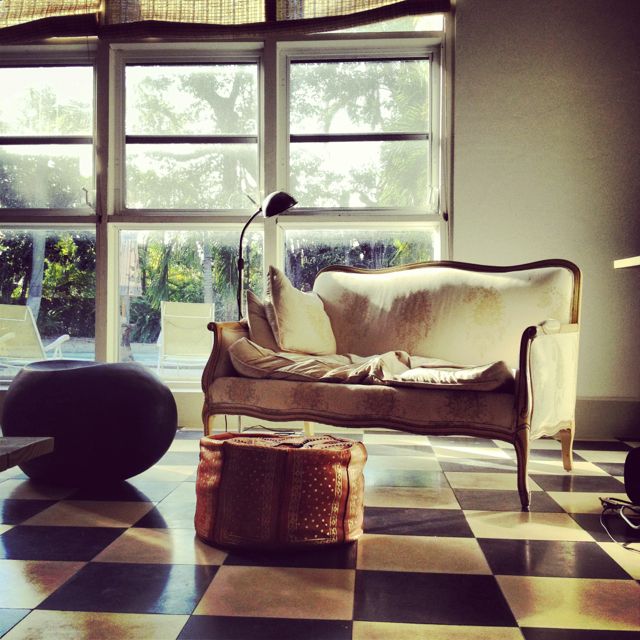
Where is `checkered ground`? The width and height of the screenshot is (640, 640). checkered ground is located at coordinates (571, 559), (560, 612).